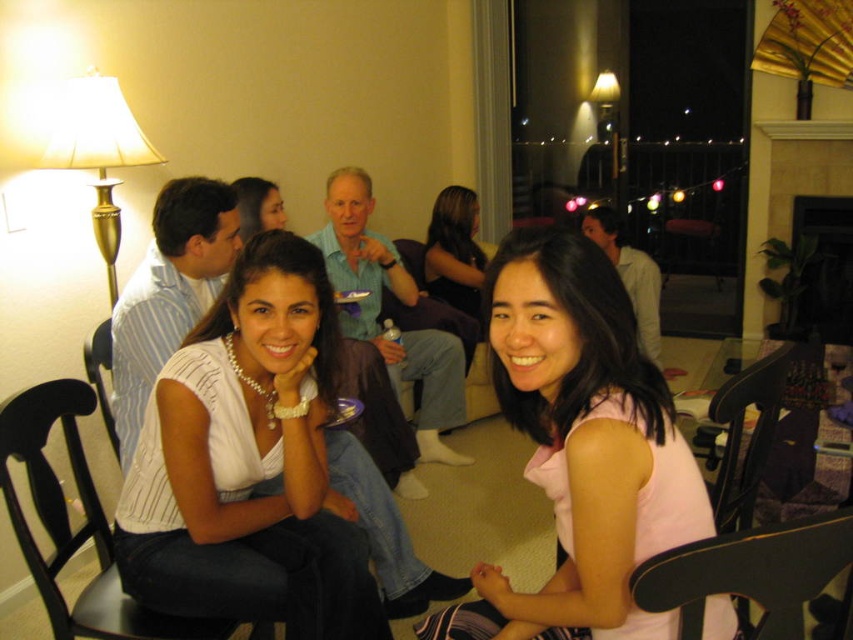
Is point (474, 605) closer to viewer compared to point (722, 540)?

No.

Is pink fabric dress at center above black leather chair at lower right?

Indeed, pink fabric dress at center is positioned over black leather chair at lower right.

Which is in front, point (724, 600) or point (759, 532)?

Point (759, 532)

At what (x,y) coordinates should I click in order to perform the action: click on pink fabric dress at center. Please return your answer as a coordinate pair (x, y). Looking at the image, I should click on point(581,445).

Can you confirm if smooth brown hair at center is positioned below matte black hair at center?

Indeed, smooth brown hair at center is positioned under matte black hair at center.

In the scene shown: Is smooth brown hair at center wider than matte black hair at center?

Indeed, smooth brown hair at center has a greater width compared to matte black hair at center.

Which is in front, point (448, 253) or point (267, 196)?

Point (267, 196) is more forward.

At what (x,y) coordinates should I click in order to perform the action: click on smooth brown hair at center. Please return your answer as a coordinate pair (x, y). This screenshot has width=853, height=640. Looking at the image, I should click on (456, 252).

Is point (276, 216) positioned behind point (97, 340)?

Yes, it is behind point (97, 340).

Is matte black hair at center below black leather chair at lower left?

Incorrect, matte black hair at center is not positioned below black leather chair at lower left.

You are a GUI agent. You are given a task and a screenshot of the screen. Output one action in this format:
    pyautogui.click(x=<x>, y=<y>)
    Task: Click on the matte black hair at center
    The height and width of the screenshot is (640, 853).
    Given the screenshot: What is the action you would take?
    pyautogui.click(x=257, y=205)

The width and height of the screenshot is (853, 640). I want to click on matte black hair at center, so click(x=257, y=205).